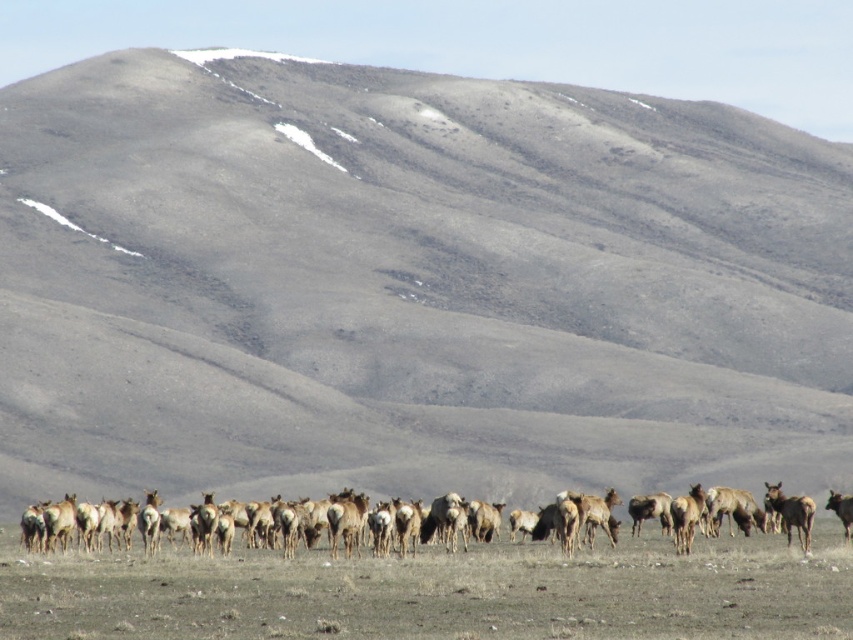
Does brown fur herd at lower center have a smaller size compared to brown furry elk at center?

Correct, brown fur herd at lower center occupies less space than brown furry elk at center.

Is brown fur herd at lower center shorter than brown furry elk at center?

Yes.

The image size is (853, 640). What do you see at coordinates (744, 532) in the screenshot? I see `brown fur herd at lower center` at bounding box center [744, 532].

The height and width of the screenshot is (640, 853). In order to click on brown fur herd at lower center in this screenshot , I will do `click(744, 532)`.

Is brown textured grassland at center bigger than brown furry elk at center?

Incorrect, brown textured grassland at center is not larger than brown furry elk at center.

Does brown textured grassland at center have a lesser width compared to brown furry elk at center?

In fact, brown textured grassland at center might be wider than brown furry elk at center.

I want to click on brown textured grassland at center, so click(x=436, y=593).

Where is `brown textured grassland at center`? The image size is (853, 640). brown textured grassland at center is located at coordinates (436, 593).

Does point (445, 612) come behind point (474, 508)?

No, it is not.

Which is more to the left, brown textured grassland at center or brown fur herd at lower center?

brown textured grassland at center

Which is in front, point (113, 632) or point (187, 522)?

Point (113, 632) is in front.

This screenshot has height=640, width=853. Find the location of `brown textured grassland at center`. brown textured grassland at center is located at coordinates (436, 593).